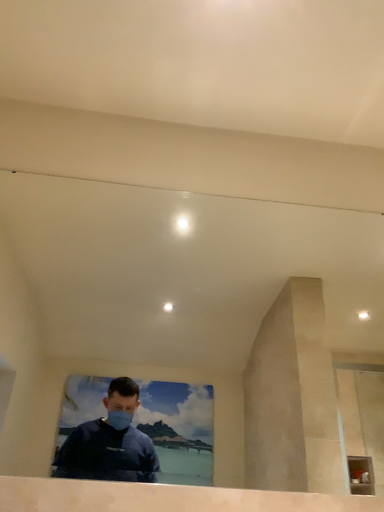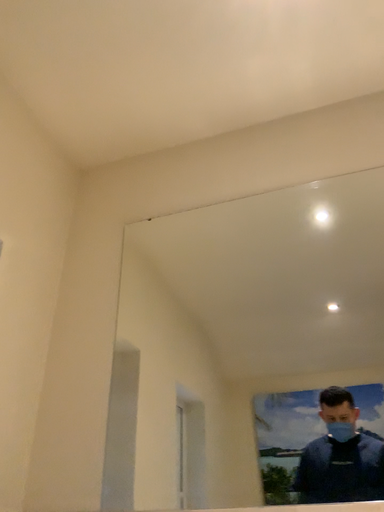
Question: How did the camera likely rotate when shooting the video?

Choices:
 (A) rotated right
 (B) rotated left

Answer: (B)